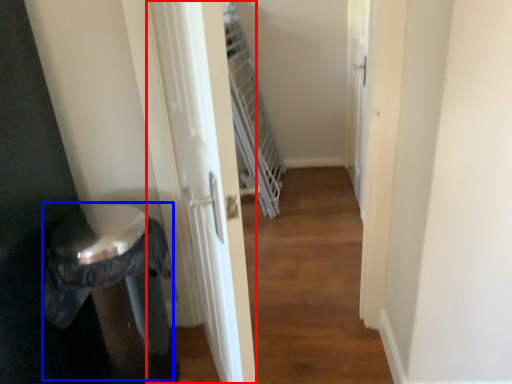
Question: Which of the following is the closest to the observer, screen door (highlighted by a red box) or potty (highlighted by a blue box)?

Choices:
 (A) screen door
 (B) potty

Answer: (A)